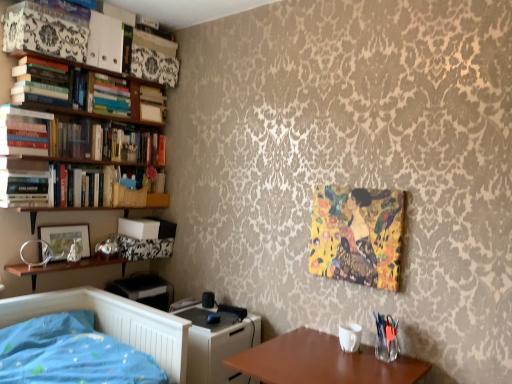
The height and width of the screenshot is (384, 512). In order to click on vacant region above hardcover books at left, which is counted as the 3th book, starting from the bottom (from a real-world perspective) in this screenshot , I will do `click(26, 107)`.